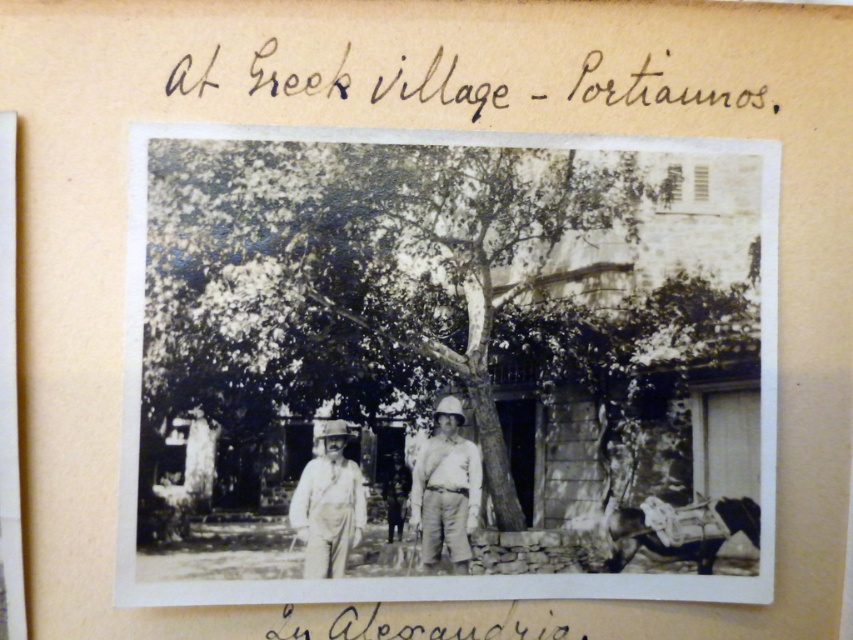
Between smooth white hat at center and black ink writing at lower center, which one appears on the left side from the viewer's perspective?

smooth white hat at center

Between smooth white hat at center and black ink writing at lower center, which one is positioned lower?

black ink writing at lower center is lower down.

Image resolution: width=853 pixels, height=640 pixels. I want to click on smooth white hat at center, so click(x=328, y=504).

Does smooth bark tree at center have a smaller size compared to black ink writing at lower center?

Incorrect, smooth bark tree at center is not smaller in size than black ink writing at lower center.

This screenshot has width=853, height=640. What do you see at coordinates (442, 289) in the screenshot?
I see `smooth bark tree at center` at bounding box center [442, 289].

Is point (186, 291) more distant than point (367, 620)?

That is True.

Find the location of `smooth bark tree at center`. smooth bark tree at center is located at coordinates (442, 289).

Does point (280, 74) lie behind point (299, 618)?

Yes, it is.

Is point (315, 92) in front of point (393, 627)?

No, (315, 92) is further to viewer.

Locate an element on the screen. black ink writing at upper center is located at coordinates (376, 81).